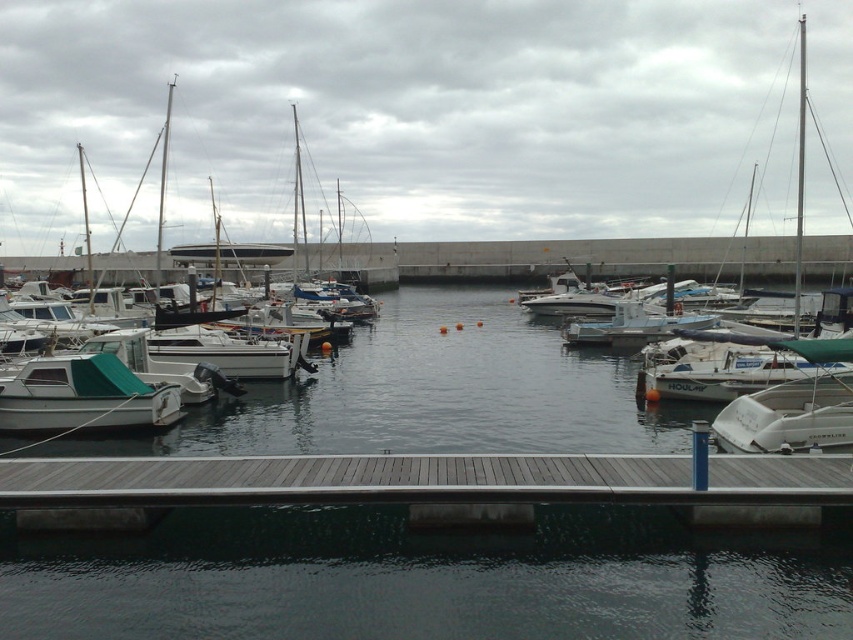
Question: Which object is closer to the camera taking this photo?

Choices:
 (A) white matte boat at left
 (B) clear water at center

Answer: (B)

Question: Does clear water at center have a lesser width compared to wooden dock at center?

Choices:
 (A) yes
 (B) no

Answer: (B)

Question: Can you confirm if clear water at center is smaller than white matte sailboat at left?

Choices:
 (A) yes
 (B) no

Answer: (A)

Question: Which object is the farthest from the white matte boat at left?

Choices:
 (A) wooden dock at center
 (B) white matte sailboat at left

Answer: (B)

Question: Can you confirm if wooden dock at center is wider than white matte boat at left?

Choices:
 (A) yes
 (B) no

Answer: (B)

Question: Which object is farther from the camera taking this photo?

Choices:
 (A) white matte sailboat at left
 (B) wooden dock at center
 (C) clear water at center

Answer: (A)